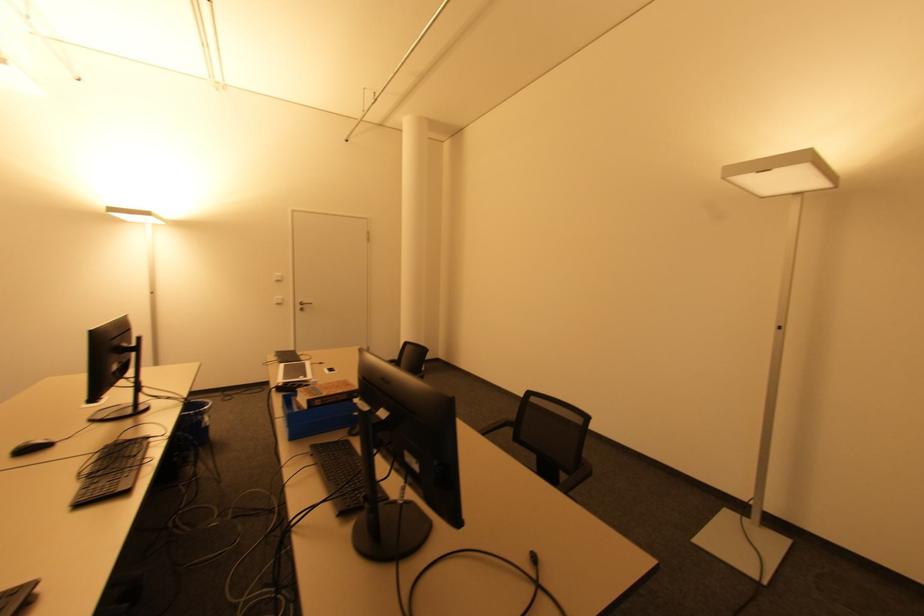
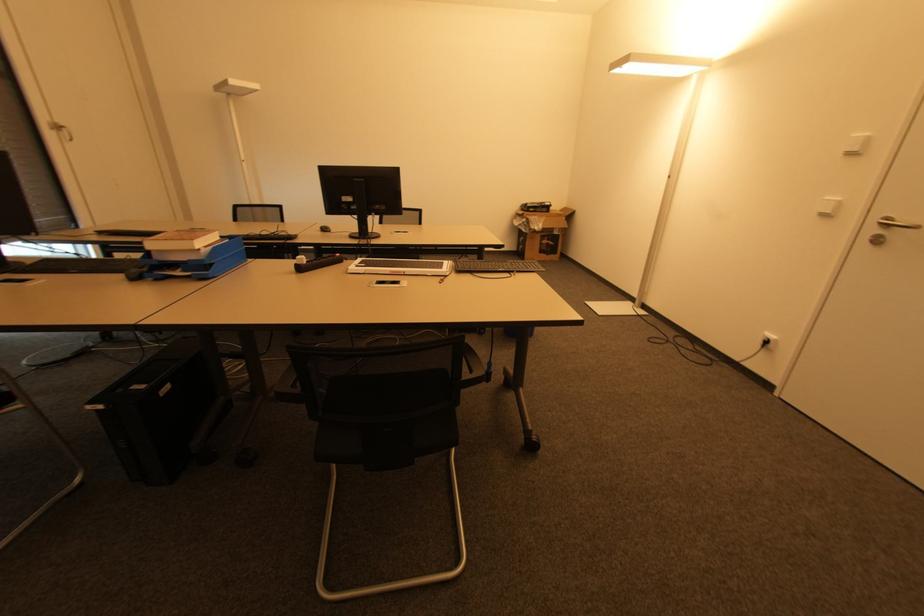
Find the pixel in the second image that matches [308,378] in the first image.

(359, 267)